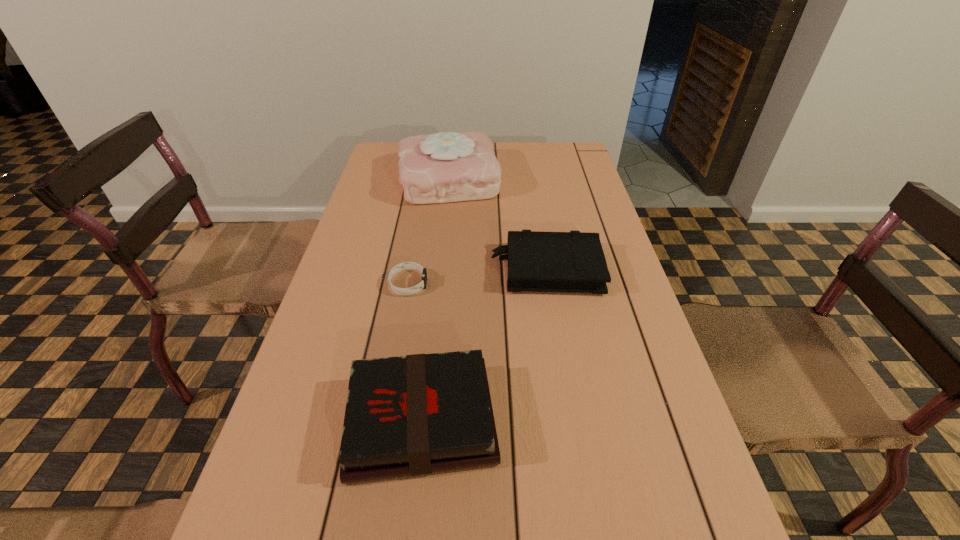
Locate an element on the screen. This screenshot has height=540, width=960. free space between the hardback book and the farthest object is located at coordinates (435, 300).

The image size is (960, 540). Find the location of `vacant point located between the shortest object and the Bible`. vacant point located between the shortest object and the Bible is located at coordinates (477, 276).

Where is `empty space that is in between the Bible and the nearest object`? This screenshot has width=960, height=540. empty space that is in between the Bible and the nearest object is located at coordinates (484, 345).

Find the location of a particular element. The height and width of the screenshot is (540, 960). vacant point located between the wristband and the Bible is located at coordinates (477, 276).

Image resolution: width=960 pixels, height=540 pixels. Find the location of `unoccupied area between the Bible and the wristband`. unoccupied area between the Bible and the wristband is located at coordinates (477, 276).

Locate an element on the screen. This screenshot has height=540, width=960. free space that is in between the farthest object and the Bible is located at coordinates (497, 224).

Identify which object is located as the third nearest to the wristband. Please provide its 2D coordinates. Your answer should be formatted as a tuple, i.e. [(x, y)], where the tuple contains the x and y coordinates of a point satisfying the conditions above.

[(443, 167)]

The height and width of the screenshot is (540, 960). Identify the location of object that is the third nearest to the Bible. (417, 414).

Locate an element on the screen. vacant position in the image that satisfies the following two spatial constraints: 1. on the outer surface of the hardback book; 2. on the left side of the wristband is located at coordinates (384, 421).

Find the location of `blank space that satisfies the following two spatial constraints: 1. on the front side of the tallest object; 2. on the outer surface of the wristband`. blank space that satisfies the following two spatial constraints: 1. on the front side of the tallest object; 2. on the outer surface of the wristband is located at coordinates (439, 284).